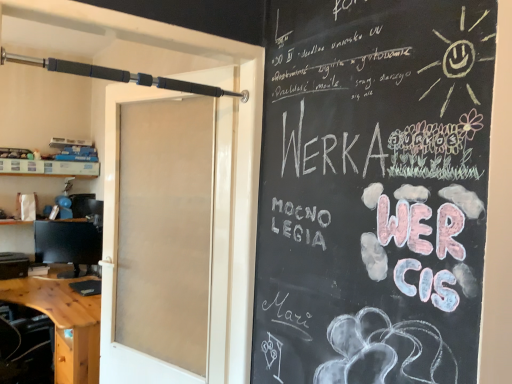
In order to click on free space in front of matte black monitor at left in this screenshot , I will do `click(52, 286)`.